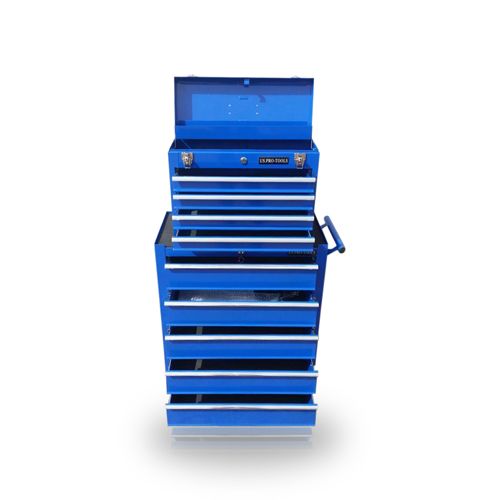
Where is `lock`? The height and width of the screenshot is (500, 500). lock is located at coordinates (243, 160).